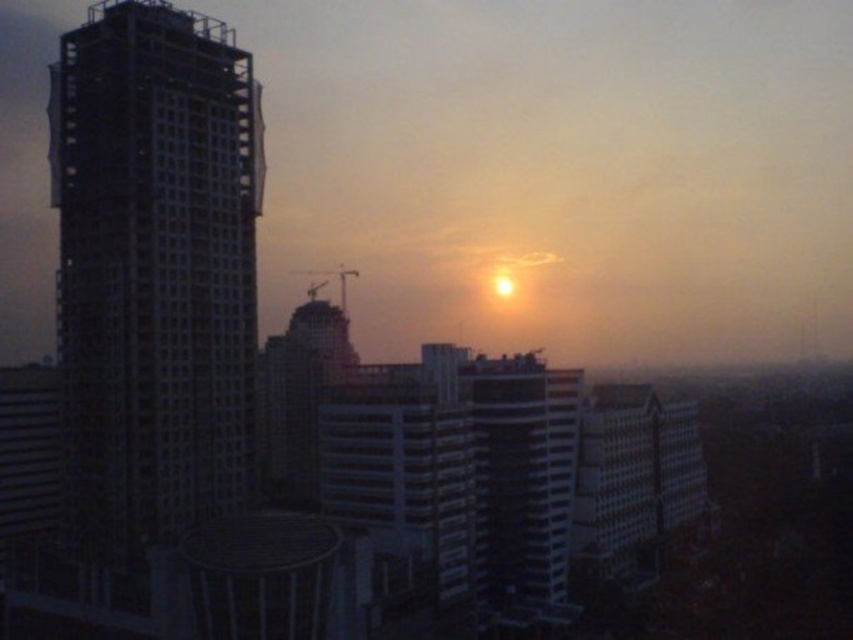
You are a city planner reviewing this area. You need to determine the spatial relationship between the metallic grid tower at left and the smooth glass building at center. Which one is positioned to the left?

The metallic grid tower at left is positioned to the left of the smooth glass building at center.

You are standing at the base of the metallic grid tower at left. You want to walk to the nearby park entrance located 100 meters away from the tower. Can you reach the park entrance without moving more than 100 meters from the tower?

The metallic grid tower at left is 88.68 meters away from the viewer. Since the park entrance is 100 meters away from the tower, you can reach it without exceeding the 100 meter limit.